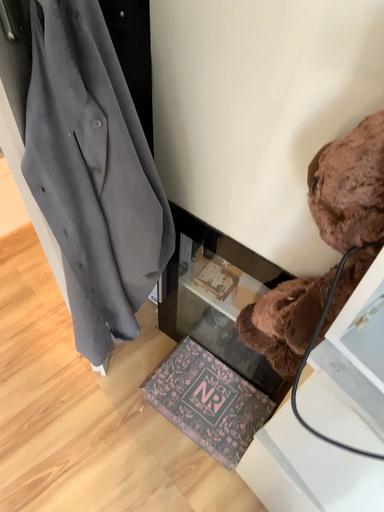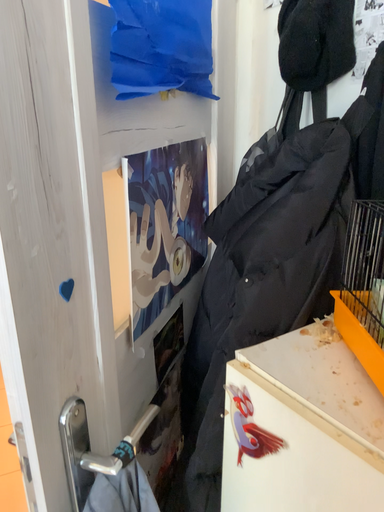
Question: How did the camera likely rotate when shooting the video?

Choices:
 (A) rotated downward
 (B) rotated upward

Answer: (B)